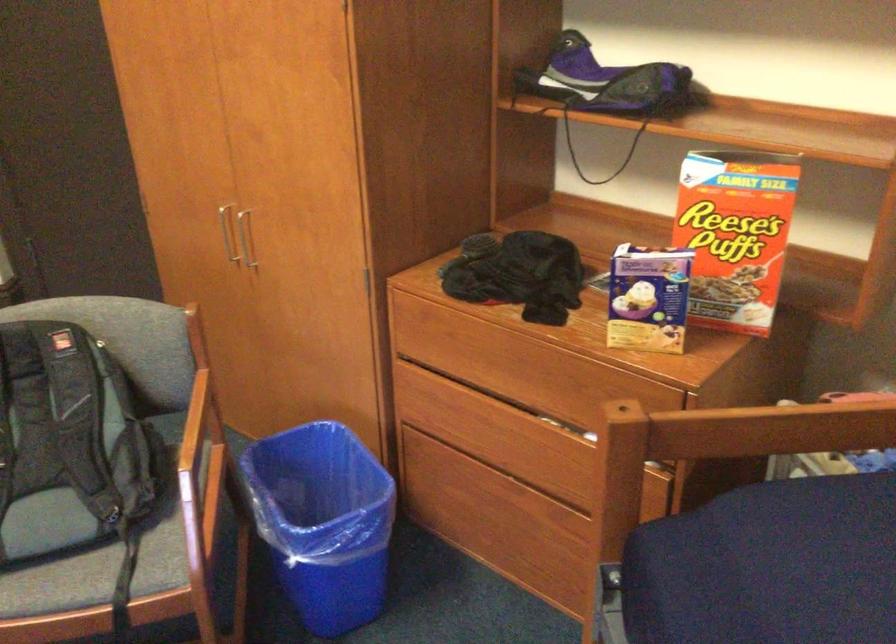
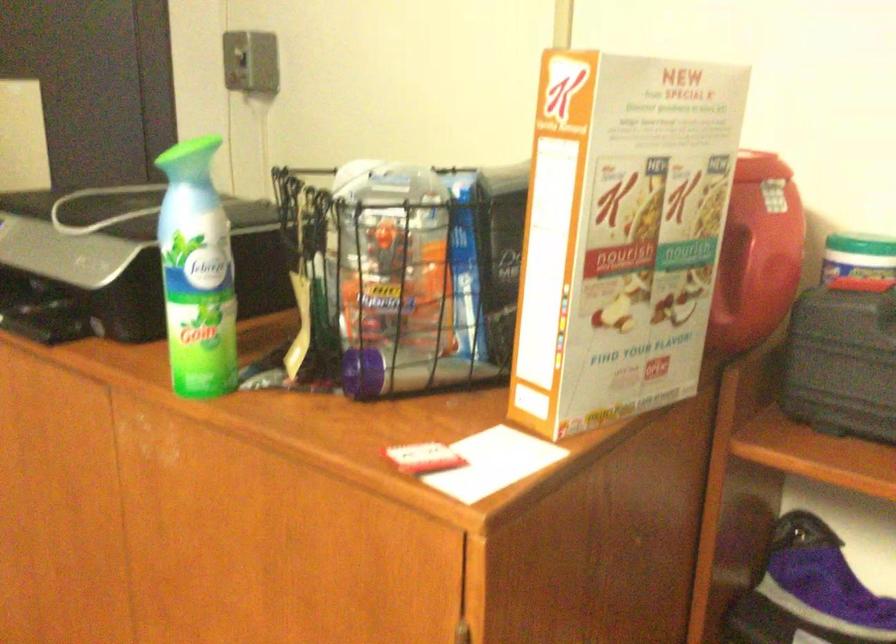
Question: What movement of the cameraman would produce the second image?

Choices:
 (A) Left
 (B) Right
 (C) Forward
 (D) Backward

Answer: (C)